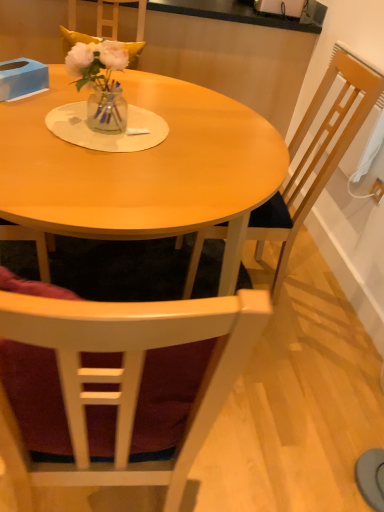
I want to click on free space to the back side of translucent glass vase at center, so click(x=125, y=104).